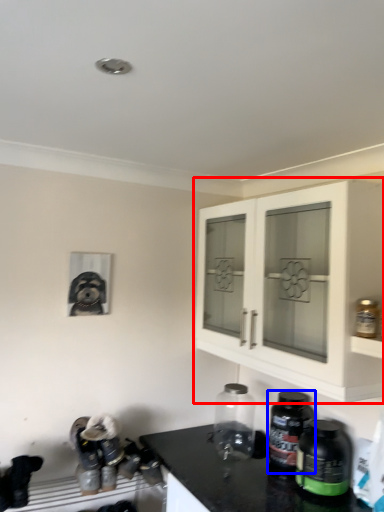
Question: Which object is closer to the camera taking this photo, cabinetry (highlighted by a red box) or bottle (highlighted by a blue box)?

Choices:
 (A) cabinetry
 (B) bottle

Answer: (A)